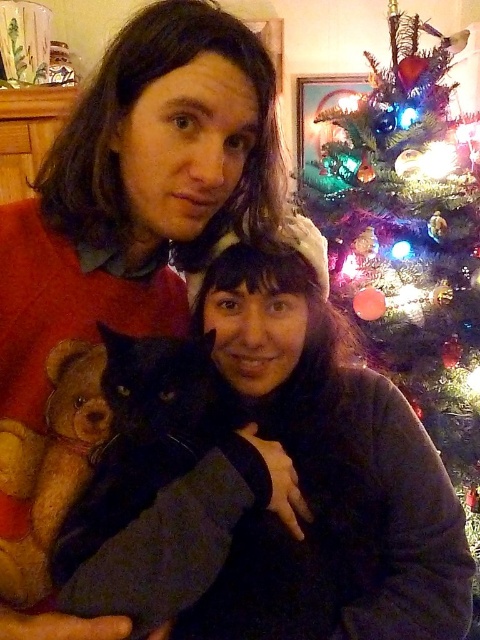
You are a photographer trying to capture a photo of the green matte christmas tree at upper right and the black fur cat at center. Which object should you focus on first if you want to ensure both are in focus, considering their sizes?

The green matte christmas tree at upper right is much taller than the black fur cat at center, so you should focus on the tree first to ensure both are in focus.

You are planning to place a new ornament on the highest point of the green matte christmas tree at upper right. Considering the height of the light brown plush teddy bear at left, can you estimate how much higher the top of the tree is compared to the teddy bear?

The green matte christmas tree at upper right is much taller than the light brown plush teddy bear at left, so the tree is significantly higher.